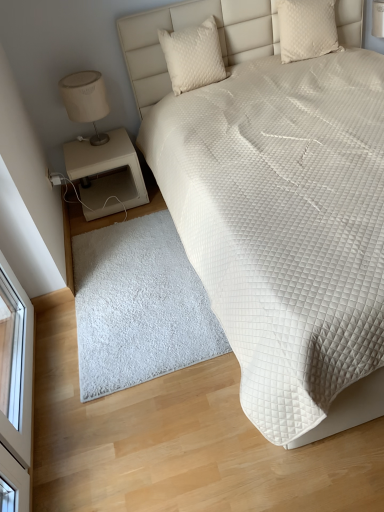
Question: Is white quilted bed at upper right taller than white quilted pillow at upper right, arranged as the first pillow when viewed from the right?

Choices:
 (A) yes
 (B) no

Answer: (A)

Question: Does white quilted bed at upper right have a larger size compared to white quilted pillow at upper right, arranged as the first pillow when viewed from the right?

Choices:
 (A) no
 (B) yes

Answer: (B)

Question: Is white quilted bed at upper right next to white quilted pillow at upper right, marked as the 2th pillow in a left-to-right arrangement?

Choices:
 (A) no
 (B) yes

Answer: (A)

Question: Is white quilted bed at upper right oriented towards white quilted pillow at upper right, marked as the 2th pillow in a left-to-right arrangement?

Choices:
 (A) yes
 (B) no

Answer: (B)

Question: From a real-world perspective, does white quilted bed at upper right sit lower than white quilted pillow at upper right, marked as the 2th pillow in a left-to-right arrangement?

Choices:
 (A) no
 (B) yes

Answer: (B)

Question: Considering the positions of white fluffy rug at lower center and white quilted bed at upper right in the image, is white fluffy rug at lower center wider or thinner than white quilted bed at upper right?

Choices:
 (A) wide
 (B) thin

Answer: (B)

Question: From the image's perspective, is white fluffy rug at lower center positioned above or below white quilted bed at upper right?

Choices:
 (A) below
 (B) above

Answer: (A)

Question: Based on their sizes in the image, would you say white fluffy rug at lower center is bigger or smaller than white quilted bed at upper right?

Choices:
 (A) small
 (B) big

Answer: (A)

Question: Is white fluffy rug at lower center inside the boundaries of white quilted bed at upper right, or outside?

Choices:
 (A) outside
 (B) inside

Answer: (A)

Question: Looking at their shapes, would you say quilted cream pillow at upper center, arranged as the second pillow when viewed from the right, is wider or thinner than matte beige lampshade at left?

Choices:
 (A) thin
 (B) wide

Answer: (A)

Question: Is quilted cream pillow at upper center, the 1th pillow positioned from the left, taller or shorter than matte beige lampshade at left?

Choices:
 (A) tall
 (B) short

Answer: (B)

Question: Would you say quilted cream pillow at upper center, the 1th pillow positioned from the left, is to the left or to the right of matte beige lampshade at left in the picture?

Choices:
 (A) right
 (B) left

Answer: (A)

Question: Is point (173, 75) positioned closer to the camera than point (102, 104)?

Choices:
 (A) farther
 (B) closer

Answer: (A)

Question: Is quilted cream pillow at upper center, arranged as the second pillow when viewed from the right, in front of or behind beige matte nightstand at lower left in the image?

Choices:
 (A) front
 (B) behind

Answer: (A)

Question: Is point (183, 52) closer or farther from the camera than point (115, 152)?

Choices:
 (A) farther
 (B) closer

Answer: (B)